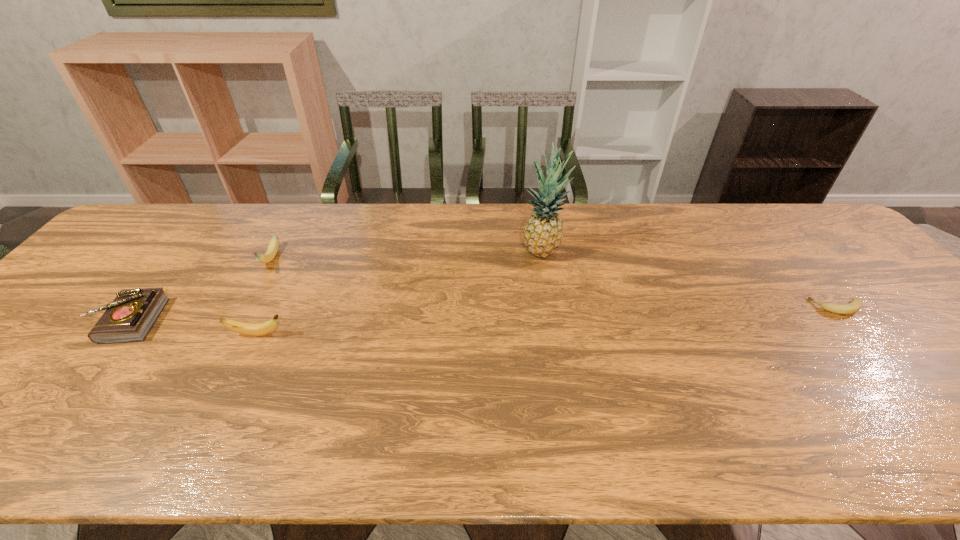
Where is `free location located 0.090m at the stem of the nearest banana`? free location located 0.090m at the stem of the nearest banana is located at coordinates (323, 335).

The image size is (960, 540). Find the location of `vacant space situated on the right of the second shortest object`. vacant space situated on the right of the second shortest object is located at coordinates (238, 321).

You are a GUI agent. You are given a task and a screenshot of the screen. Output one action in this format:
    pyautogui.click(x=<x>, y=<y>)
    Task: Click on the vacant area located at the stem of the shortest banana
    
    Given the screenshot: What is the action you would take?
    686,308

The width and height of the screenshot is (960, 540). What are the coordinates of `free space located 0.170m at the stem of the shortest banana` in the screenshot? It's located at (748, 308).

Find the location of a particular element. This screenshot has height=540, width=960. blank space located at the stem of the shortest banana is located at coordinates (744, 308).

The image size is (960, 540). In order to click on pineapple located at the far edge in this screenshot , I will do (543, 233).

Image resolution: width=960 pixels, height=540 pixels. I want to click on banana that is at the far edge, so click(x=272, y=250).

Locate an element on the screen. The height and width of the screenshot is (540, 960). object that is at the left edge is located at coordinates (129, 318).

Locate an element on the screen. The height and width of the screenshot is (540, 960). object present at the right edge is located at coordinates (855, 305).

Where is `vacant space at the far edge of the desktop`? The height and width of the screenshot is (540, 960). vacant space at the far edge of the desktop is located at coordinates (504, 217).